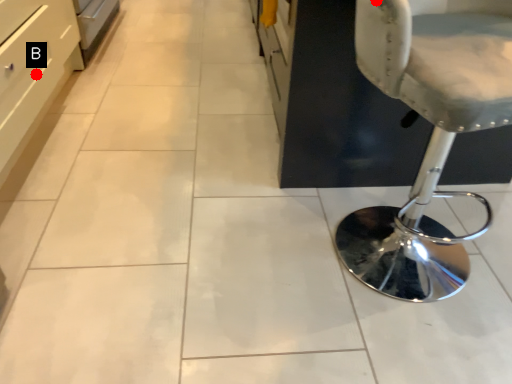
Question: Two points are circled on the image, labeled by A and B beside each circle. Which point is further to the camera?

Choices:
 (A) A is further
 (B) B is further

Answer: (B)